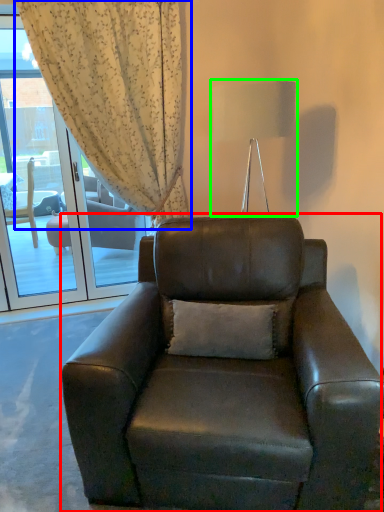
Question: Estimate the real-world distances between objects in this image. Which object is farther from chair (highlighted by a red box), curtain (highlighted by a blue box) or lamp (highlighted by a green box)?

Choices:
 (A) curtain
 (B) lamp

Answer: (A)